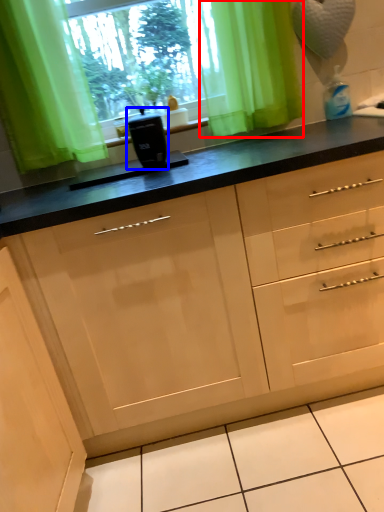
Question: Which object is further to the camera taking this photo, curtain (highlighted by a red box) or appliance (highlighted by a blue box)?

Choices:
 (A) curtain
 (B) appliance

Answer: (A)